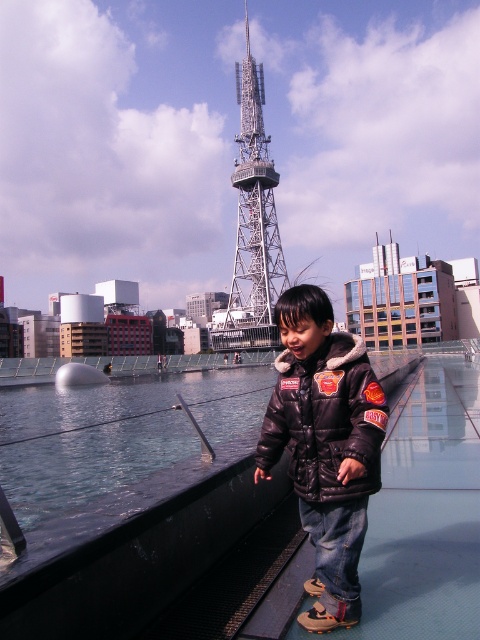
You are a drone operator trying to navigate between two points in the image. The first point is point (361, 419) and the second is point (241, 138). Which point is closer to you?

Point (361, 419) is closer to the viewer than point (241, 138).